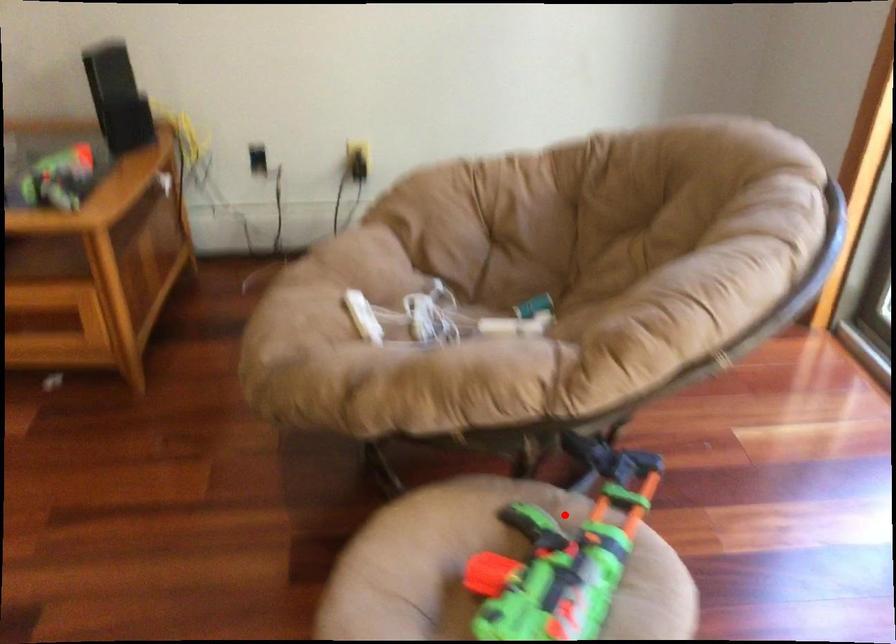
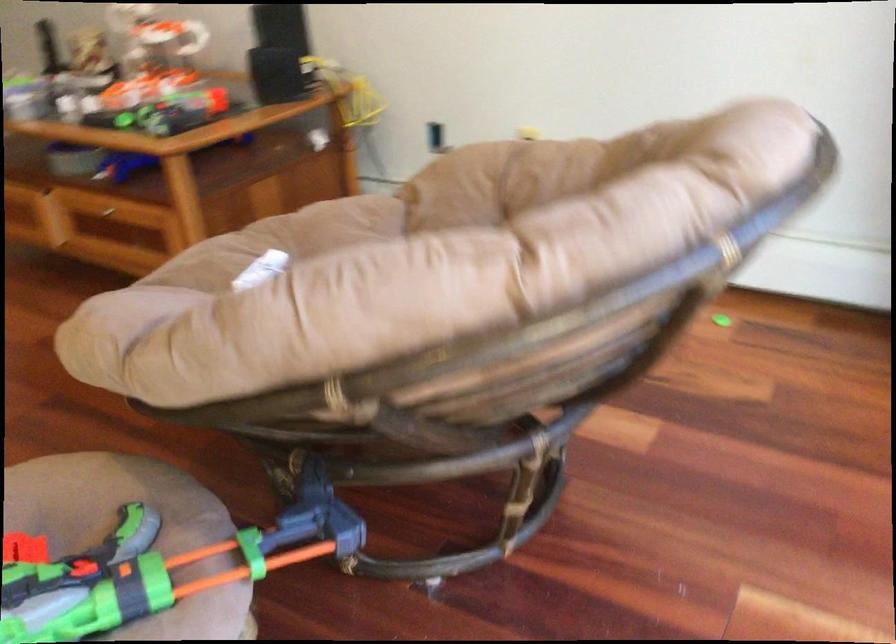
Question: I am providing you with two images of the same scene from different viewpoints. Image1 has a red point marked. In image2, the corresponding 3D location appears at what relative position? Reply with the corresponding letter.

Choices:
 (A) Closer
 (B) Farther

Answer: (A)